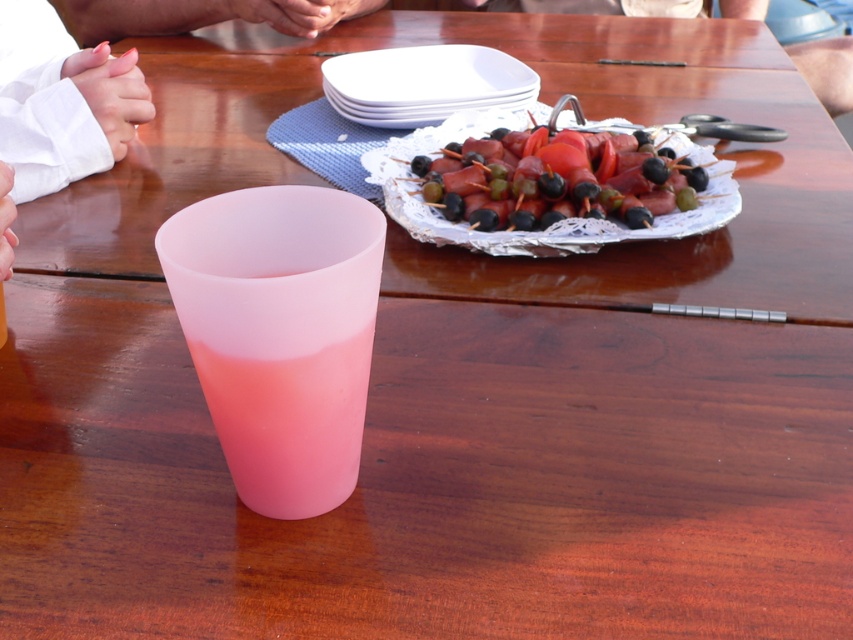
You are at the point labeled point (283, 440) and want to move towards point (497, 93). Is the path between these two points clear of any obstacles?

Yes, the path between point (283, 440) and point (497, 93) is clear of any obstacles because point (283, 440) is in front of point (497, 93), indicating no objects are blocking the way.

You are setting up a small picnic and need to place the translucent pink cup at center and the white matte platter at upper center on a shelf. The shelf has limited vertical space. Which item should you place first to ensure both fit without adjusting their positions?

The translucent pink cup at center should be placed first because it has a lesser height compared to the white matte platter at upper center, so placing it first ensures there is enough vertical space for both items.